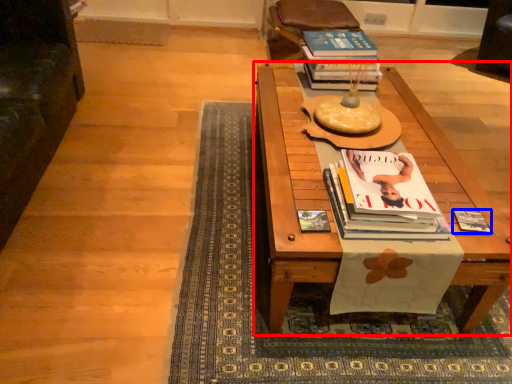
Question: Which object appears closest to the camera in this image, table (highlighted by a red box) or book (highlighted by a blue box)?

Choices:
 (A) table
 (B) book

Answer: (A)